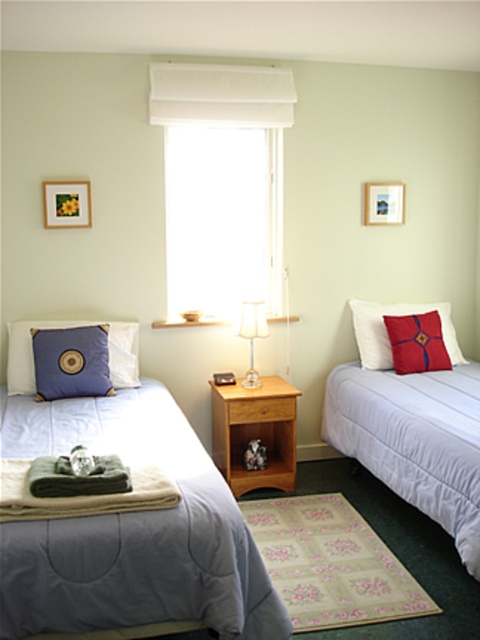
Question: Which point is closer to the camera taking this photo?

Choices:
 (A) (264, 333)
 (B) (84, 205)

Answer: (B)

Question: Among these points, which one is nearest to the camera?

Choices:
 (A) (254, 324)
 (B) (399, 182)

Answer: (A)

Question: Can you confirm if white soft bed at right is positioned to the right of beige soft blanket at lower left?

Choices:
 (A) yes
 (B) no

Answer: (A)

Question: Estimate the real-world distances between objects in this image. Which object is closer to the red velvet cushion at right?

Choices:
 (A) wooden picture frame at upper left
 (B) matte blue pillow at left
 (C) light blue quilted blanket at left

Answer: (B)

Question: Can you confirm if beige soft blanket at lower left is positioned to the right of white fabric lamp at center?

Choices:
 (A) no
 (B) yes

Answer: (A)

Question: Can you confirm if white fabric window at center is smaller than red velvet cushion at right?

Choices:
 (A) no
 (B) yes

Answer: (A)